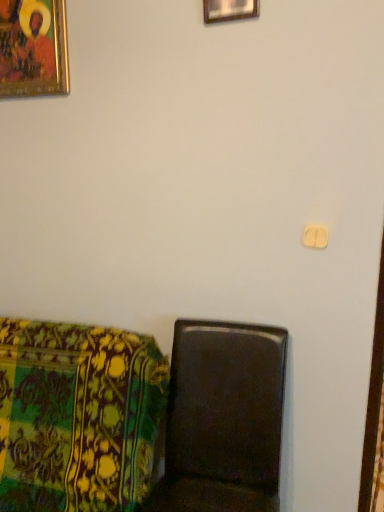
Question: Does matte brown chair at lower left, the second furniture when ordered from left to right, turn towards gold-framed painting at upper left, which appears as the first picture frame when viewed from the left?

Choices:
 (A) yes
 (B) no

Answer: (B)

Question: Considering the relative sizes of matte brown chair at lower left, the second furniture when ordered from left to right, and gold-framed painting at upper left, the second picture frame viewed from the front, in the image provided, is matte brown chair at lower left, the second furniture when ordered from left to right, taller than gold-framed painting at upper left, the second picture frame viewed from the front,?

Choices:
 (A) no
 (B) yes

Answer: (B)

Question: From a real-world perspective, is matte brown chair at lower left, the second furniture when ordered from left to right, below gold-framed painting at upper left, which is the second picture frame from right to left?

Choices:
 (A) no
 (B) yes

Answer: (B)

Question: Does matte brown chair at lower left, marked as the first furniture in a right-to-left arrangement, have a smaller size compared to gold-framed painting at upper left, the first picture frame when ordered from back to front?

Choices:
 (A) no
 (B) yes

Answer: (A)

Question: Considering the relative sizes of matte brown chair at lower left, marked as the first furniture in a right-to-left arrangement, and gold-framed painting at upper left, the first picture frame when ordered from back to front, in the image provided, is matte brown chair at lower left, marked as the first furniture in a right-to-left arrangement, bigger than gold-framed painting at upper left, the first picture frame when ordered from back to front,?

Choices:
 (A) yes
 (B) no

Answer: (A)

Question: Considering the positions of point (210, 15) and point (33, 500), is point (210, 15) closer or farther from the camera than point (33, 500)?

Choices:
 (A) closer
 (B) farther

Answer: (A)

Question: In terms of height, does wooden picture frame at upper center, the first picture frame viewed from the right, look taller or shorter compared to floral fabric cushion at lower left, which is the first furniture in left-to-right order?

Choices:
 (A) short
 (B) tall

Answer: (A)

Question: From a real-world perspective, is wooden picture frame at upper center, the first picture frame viewed from the right, physically located above or below floral fabric cushion at lower left, the second furniture from the right?

Choices:
 (A) above
 (B) below

Answer: (A)

Question: Looking at their shapes, would you say wooden picture frame at upper center, the 2th picture frame viewed from the back, is wider or thinner than floral fabric cushion at lower left, the second furniture from the right?

Choices:
 (A) wide
 (B) thin

Answer: (B)

Question: In terms of size, does matte brown chair at lower left, marked as the first furniture in a right-to-left arrangement, appear bigger or smaller than gold-framed painting at upper left, which appears as the first picture frame when viewed from the left?

Choices:
 (A) small
 (B) big

Answer: (B)

Question: Is matte brown chair at lower left, the second furniture when ordered from left to right, inside or outside of gold-framed painting at upper left, the first picture frame when ordered from back to front?

Choices:
 (A) outside
 (B) inside

Answer: (A)

Question: Considering the positions of matte brown chair at lower left, the second furniture when ordered from left to right, and gold-framed painting at upper left, the first picture frame when ordered from back to front, in the image, is matte brown chair at lower left, the second furniture when ordered from left to right, taller or shorter than gold-framed painting at upper left, the first picture frame when ordered from back to front,?

Choices:
 (A) short
 (B) tall

Answer: (B)

Question: Considering their positions, is matte brown chair at lower left, the second furniture when ordered from left to right, located in front of or behind gold-framed painting at upper left, the first picture frame when ordered from back to front?

Choices:
 (A) behind
 (B) front

Answer: (B)

Question: Choose the correct answer: Is matte brown chair at lower left, the second furniture when ordered from left to right, inside floral fabric cushion at lower left, the second furniture from the right, or outside it?

Choices:
 (A) inside
 (B) outside

Answer: (B)

Question: From a real-world perspective, is matte brown chair at lower left, the second furniture when ordered from left to right, positioned above or below floral fabric cushion at lower left, the second furniture from the right?

Choices:
 (A) above
 (B) below

Answer: (A)